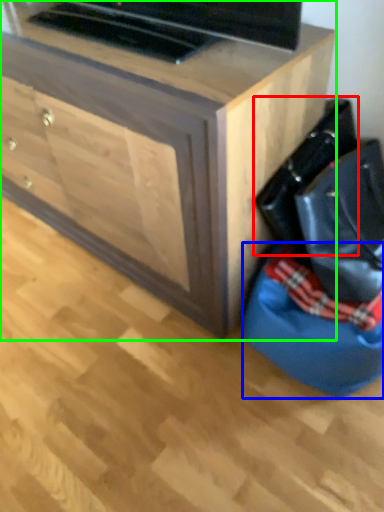
Question: Estimate the real-world distances between objects in this image. Which object is farther from messenger bag (highlighted by a red box), bean bag chair (highlighted by a blue box) or chest of drawers (highlighted by a green box)?

Choices:
 (A) bean bag chair
 (B) chest of drawers

Answer: (B)